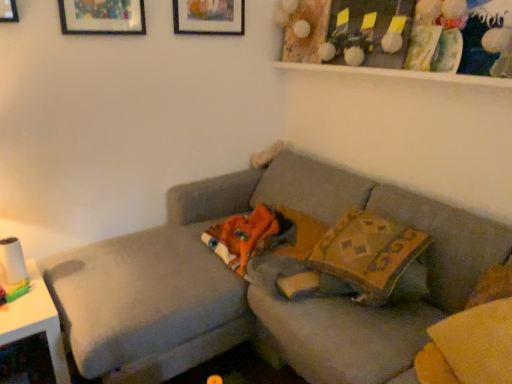
Question: Is textured gray couch at center to the left or to the right of patterned fabric pillow at center in the image?

Choices:
 (A) right
 (B) left

Answer: (B)

Question: Does point (153, 367) appear closer or farther from the camera than point (358, 225)?

Choices:
 (A) closer
 (B) farther

Answer: (A)

Question: Based on their relative distances, which object is nearer to the matte wooden picture frame at upper center?

Choices:
 (A) white glossy table at left
 (B) patterned fabric pillow at center
 (C) wooden shelf at upper center
 (D) textured gray couch at center

Answer: (C)

Question: Which of these objects is positioned closest to the patterned fabric pillow at center?

Choices:
 (A) textured gray couch at center
 (B) white glossy table at left
 (C) wooden shelf at upper center
 (D) matte wooden picture frame at upper center

Answer: (A)